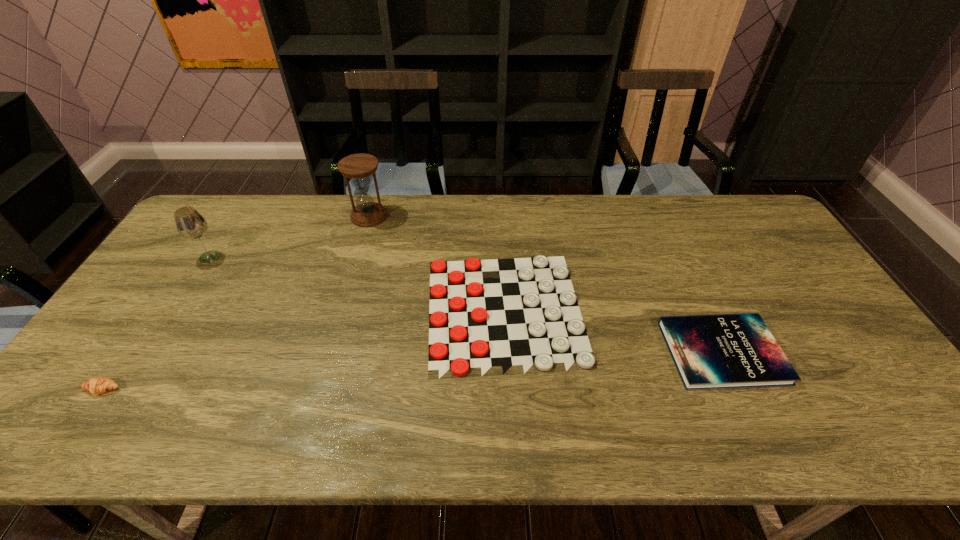
Locate an element on the screen. free region located on the front-facing side of the third tallest object is located at coordinates (68, 439).

In order to click on free space located on the back of the fourth tallest object in this screenshot , I will do `click(663, 227)`.

This screenshot has width=960, height=540. Identify the location of blank area located 0.120m on the back of the fourth object from left to right. (500, 232).

Locate an element on the screen. The image size is (960, 540). object positioned at the far edge is located at coordinates (358, 167).

The width and height of the screenshot is (960, 540). In order to click on wineglass that is at the left edge in this screenshot , I will do `click(190, 224)`.

You are a GUI agent. You are given a task and a screenshot of the screen. Output one action in this format:
    pyautogui.click(x=<x>, y=<y>)
    Task: Click on the pastry that is at the left edge
    
    Given the screenshot: What is the action you would take?
    pyautogui.click(x=98, y=385)

Identify the location of free space at the far edge of the desktop. The height and width of the screenshot is (540, 960). (714, 218).

In the image, there is a desktop. Find the location of `vacant space at the near edge`. vacant space at the near edge is located at coordinates (471, 441).

Locate an element on the screen. The width and height of the screenshot is (960, 540). vacant position at the right edge of the desktop is located at coordinates (848, 385).

Locate an element on the screen. The width and height of the screenshot is (960, 540). vacant area at the near right corner of the desktop is located at coordinates (884, 427).